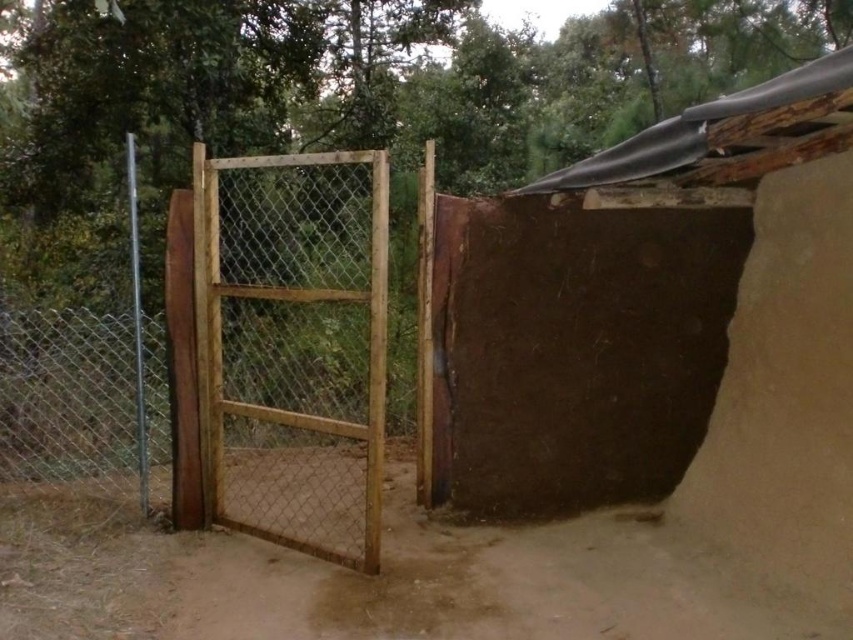
Question: Among these objects, which one is farthest from the camera?

Choices:
 (A) wooden mesh gate at center
 (B) wooden gate at left
 (C) brown sandy dirt track at center

Answer: (B)

Question: Does wooden gate at left have a larger size compared to wooden mesh gate at center?

Choices:
 (A) yes
 (B) no

Answer: (A)

Question: Estimate the real-world distances between objects in this image. Which object is farther from the wooden mesh gate at center?

Choices:
 (A) wooden gate at left
 (B) brown sandy dirt track at center

Answer: (A)

Question: Does wooden gate at left appear under wooden mesh gate at center?

Choices:
 (A) yes
 (B) no

Answer: (A)

Question: Which is nearer to the brown sandy dirt track at center?

Choices:
 (A) wooden mesh gate at center
 (B) wooden gate at left

Answer: (A)

Question: Can you confirm if wooden gate at left is positioned to the left of wooden mesh gate at center?

Choices:
 (A) yes
 (B) no

Answer: (A)